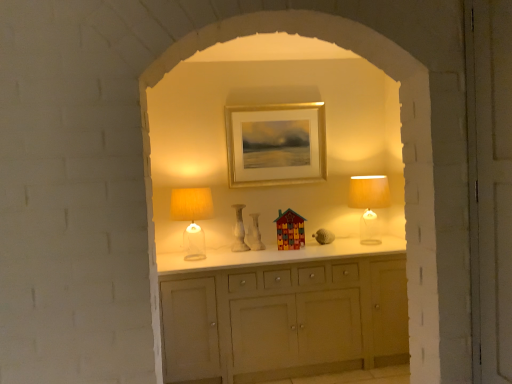
What do you see at coordinates (192, 218) in the screenshot? This screenshot has height=384, width=512. I see `translucent glass table lamp at left, which is counted as the first table lamp, starting from the left` at bounding box center [192, 218].

What is the approximate height of translucent glass table lamp at left, the 2th table lamp viewed from the right?

The height of translucent glass table lamp at left, the 2th table lamp viewed from the right, is 22.46 inches.

This screenshot has width=512, height=384. What are the coordinates of `translucent glass table lamp at right, which is counted as the first table lamp, starting from the right` in the screenshot? It's located at (369, 203).

In the image, is translucent glass table lamp at left, which is counted as the first table lamp, starting from the left, positioned in front of or behind white marble vase at center, positioned as the first vase in left-to-right order?

Clearly, translucent glass table lamp at left, which is counted as the first table lamp, starting from the left, is in front of white marble vase at center, positioned as the first vase in left-to-right order.

Is translucent glass table lamp at left, the 2th table lamp viewed from the right, oriented towards white marble vase at center, positioned as the first vase in left-to-right order?

No, translucent glass table lamp at left, the 2th table lamp viewed from the right, is not facing towards white marble vase at center, positioned as the first vase in left-to-right order.

Measure the distance from translucent glass table lamp at left, the 2th table lamp viewed from the right, to white marble vase at center, positioned as the first vase in left-to-right order.

The distance of translucent glass table lamp at left, the 2th table lamp viewed from the right, from white marble vase at center, positioned as the first vase in left-to-right order, is 17.73 inches.

How different are the orientations of translucent glass table lamp at left, which is counted as the first table lamp, starting from the left, and white marble vase at center, the second vase from the right, in degrees?

The angular difference between translucent glass table lamp at left, which is counted as the first table lamp, starting from the left, and white marble vase at center, the second vase from the right, is 1.42 degrees.

Would you say white glossy vase at center, which is counted as the 1th vase, starting from the right, is part of multicolored wooden house at center's contents?

No, white glossy vase at center, which is counted as the 1th vase, starting from the right, is not surrounded by multicolored wooden house at center.

Considering the relative positions of multicolored wooden house at center and white glossy vase at center, which is counted as the second vase, starting from the left, in the image provided, is multicolored wooden house at center to the left of white glossy vase at center, which is counted as the second vase, starting from the left, from the viewer's perspective?

No.

Which is further, (295, 221) or (258, 243)?

The point (258, 243) is behind.

From a real-world perspective, is multicolored wooden house at center physically located above or below white glossy vase at center, which is counted as the 1th vase, starting from the right?

From a real-world perspective, multicolored wooden house at center is physically above white glossy vase at center, which is counted as the 1th vase, starting from the right.

How many degrees apart are the facing directions of translucent glass table lamp at right, which is counted as the first table lamp, starting from the right, and gold metallic picture frame at center?

0.59 degrees.

In the image, is translucent glass table lamp at right, which is counted as the first table lamp, starting from the right, positioned in front of or behind gold metallic picture frame at center?

translucent glass table lamp at right, which is counted as the first table lamp, starting from the right, is in front of gold metallic picture frame at center.

Does translucent glass table lamp at right, which is counted as the first table lamp, starting from the right, have a lesser height compared to gold metallic picture frame at center?

Yes.

From a real-world perspective, is translucent glass table lamp at right, which is counted as the first table lamp, starting from the right, located higher than gold metallic picture frame at center?

No.

Do you think white marble vase at center, the second vase from the right, is within multicolored wooden house at center, or outside of it?

white marble vase at center, the second vase from the right, cannot be found inside multicolored wooden house at center.

Is there a large distance between white marble vase at center, the second vase from the right, and multicolored wooden house at center?

No, there isn't a large distance between white marble vase at center, the second vase from the right, and multicolored wooden house at center.

How different are the orientations of white marble vase at center, positioned as the first vase in left-to-right order, and multicolored wooden house at center in degrees?

white marble vase at center, positioned as the first vase in left-to-right order, and multicolored wooden house at center are facing 12.6 degrees away from each other.

Identify the location of the 1st vase below the multicolored wooden house at center (from the image's perspective). The image size is (512, 384). (239, 231).

From the image's perspective, which object appears higher, multicolored wooden house at center or white marble vase at center, the second vase from the right?

multicolored wooden house at center is shown above in the image.

Considering the relative sizes of multicolored wooden house at center and white marble vase at center, the second vase from the right, in the image provided, is multicolored wooden house at center thinner than white marble vase at center, the second vase from the right,?

Indeed, multicolored wooden house at center has a lesser width compared to white marble vase at center, the second vase from the right.

Is multicolored wooden house at center at the left side of white marble vase at center, positioned as the first vase in left-to-right order?

No, multicolored wooden house at center is not to the left of white marble vase at center, positioned as the first vase in left-to-right order.

Is gold metallic picture frame at center facing towards translucent glass table lamp at left, the 2th table lamp viewed from the right?

No, gold metallic picture frame at center is not turned towards translucent glass table lamp at left, the 2th table lamp viewed from the right.

Would you say gold metallic picture frame at center is a long distance from translucent glass table lamp at left, which is counted as the first table lamp, starting from the left?

They are positioned close to each other.

From a real-world perspective, is gold metallic picture frame at center on top of translucent glass table lamp at left, the 2th table lamp viewed from the right?

Yes, from a real-world perspective, gold metallic picture frame at center is over translucent glass table lamp at left, the 2th table lamp viewed from the right

The width and height of the screenshot is (512, 384). I want to click on picture frame above the translucent glass table lamp at left, the 2th table lamp viewed from the right (from the image's perspective), so click(276, 144).

From a real-world perspective, which is physically above, translucent glass table lamp at left, which is counted as the first table lamp, starting from the left, or gold metallic picture frame at center?

In real-world perspective, gold metallic picture frame at center is above.

The height and width of the screenshot is (384, 512). Identify the location of picture frame above the translucent glass table lamp at left, which is counted as the first table lamp, starting from the left (from the image's perspective). (276, 144).

In terms of height, does translucent glass table lamp at left, which is counted as the first table lamp, starting from the left, look taller or shorter compared to gold metallic picture frame at center?

In the image, translucent glass table lamp at left, which is counted as the first table lamp, starting from the left, appears to be shorter than gold metallic picture frame at center.

Locate an element on the screen. The width and height of the screenshot is (512, 384). the 1st vase to the right of the translucent glass table lamp at left, which is counted as the first table lamp, starting from the left, starting your count from the anchor is located at coordinates (239, 231).

You are a GUI agent. You are given a task and a screenshot of the screen. Output one action in this format:
    pyautogui.click(x=<x>, y=<y>)
    Task: Click on the art located above the white glossy vase at center, which is counted as the second vase, starting from the left (from the image's perspective)
    Image resolution: width=512 pixels, height=384 pixels.
    Given the screenshot: What is the action you would take?
    pyautogui.click(x=290, y=230)

Estimate the real-world distances between objects in this image. Which object is further from gold metallic picture frame at center, translucent glass table lamp at left, which is counted as the first table lamp, starting from the left, or white marble vase at center, the second vase from the right?

Among the two, translucent glass table lamp at left, which is counted as the first table lamp, starting from the left, is located further to gold metallic picture frame at center.

Which object lies nearer to the anchor point white glossy vase at center, which is counted as the second vase, starting from the left, translucent glass table lamp at left, which is counted as the first table lamp, starting from the left, or gold metallic picture frame at center?

translucent glass table lamp at left, which is counted as the first table lamp, starting from the left, lies closer to white glossy vase at center, which is counted as the second vase, starting from the left, than the other object.

Based on their spatial positions, is white marble vase at center, positioned as the first vase in left-to-right order, or gold metallic picture frame at center closer to multicolored wooden house at center?

white marble vase at center, positioned as the first vase in left-to-right order, is positioned closer to the anchor multicolored wooden house at center.

Considering their positions, is gold metallic picture frame at center positioned further to translucent glass table lamp at left, which is counted as the first table lamp, starting from the left, than translucent glass table lamp at right, which is counted as the first table lamp, starting from the right?

Among the two, translucent glass table lamp at right, which is counted as the first table lamp, starting from the right, is located further to translucent glass table lamp at left, which is counted as the first table lamp, starting from the left.

Estimate the real-world distances between objects in this image. Which object is further from translucent glass table lamp at left, the 2th table lamp viewed from the right, white marble vase at center, positioned as the first vase in left-to-right order, or multicolored wooden house at center?

multicolored wooden house at center is further to translucent glass table lamp at left, the 2th table lamp viewed from the right.

Considering their positions, is white glossy vase at center, which is counted as the 1th vase, starting from the right, positioned closer to gold metallic picture frame at center than translucent glass table lamp at left, which is counted as the first table lamp, starting from the left?

Among the two, white glossy vase at center, which is counted as the 1th vase, starting from the right, is located nearer to gold metallic picture frame at center.

In the scene shown: Estimate the real-world distances between objects in this image. Which object is closer to multicolored wooden house at center, gold metallic picture frame at center or white marble vase at center, the second vase from the right?

white marble vase at center, the second vase from the right, lies closer to multicolored wooden house at center than the other object.

Considering their positions, is translucent glass table lamp at left, the 2th table lamp viewed from the right, positioned closer to translucent glass table lamp at right, marked as the second table lamp in a left-to-right arrangement, than white marble vase at center, the second vase from the right?

Among the two, white marble vase at center, the second vase from the right, is located nearer to translucent glass table lamp at right, marked as the second table lamp in a left-to-right arrangement.

The width and height of the screenshot is (512, 384). I want to click on art between gold metallic picture frame at center and white marble vase at center, the second vase from the right, from top to bottom, so click(x=290, y=230).

What are the coordinates of `art between gold metallic picture frame at center and white glossy vase at center, which is counted as the second vase, starting from the left, from top to bottom` in the screenshot? It's located at (290, 230).

Locate an element on the screen. The height and width of the screenshot is (384, 512). vase between translucent glass table lamp at left, which is counted as the first table lamp, starting from the left, and white glossy vase at center, which is counted as the 1th vase, starting from the right is located at coordinates (239, 231).

Find the location of a particular element. The width and height of the screenshot is (512, 384). picture frame between white glossy vase at center, which is counted as the second vase, starting from the left, and translucent glass table lamp at right, marked as the second table lamp in a left-to-right arrangement, from left to right is located at coordinates (276, 144).